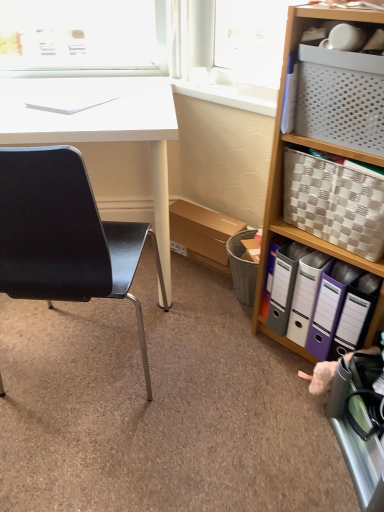
Locate an element on the screen. The height and width of the screenshot is (512, 384). vacant area located to the right-hand side of black matte chair at left is located at coordinates (210, 381).